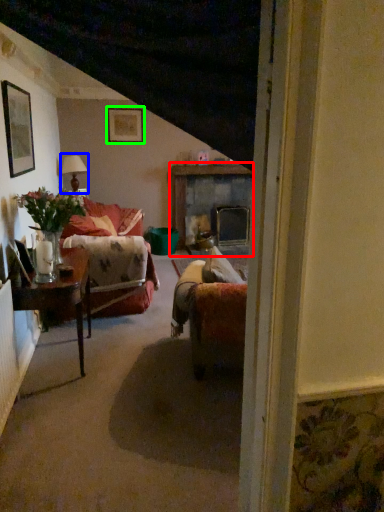
Question: Which object is the closest to the fireplace (highlighted by a red box)? Choose among these: lamp (highlighted by a blue box) or picture frame (highlighted by a green box).

Choices:
 (A) lamp
 (B) picture frame

Answer: (B)